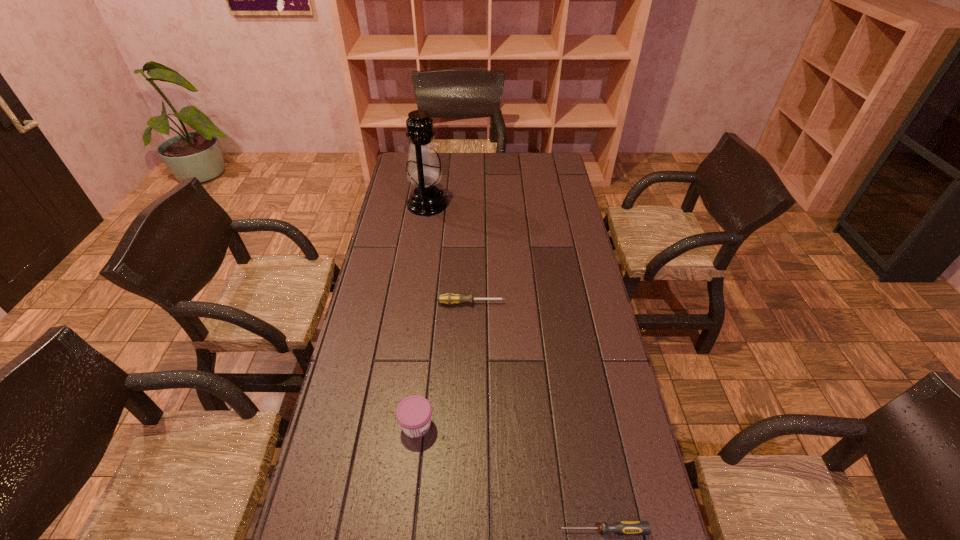
In order to click on oil lamp in this screenshot , I will do click(423, 169).

At what (x,y) coordinates should I click in order to perform the action: click on the farthest object. Please return your answer as a coordinate pair (x, y). The image size is (960, 540). Looking at the image, I should click on (423, 169).

Where is `the third farthest object`? This screenshot has height=540, width=960. the third farthest object is located at coordinates (413, 413).

Locate an element on the screen. jam is located at coordinates (413, 413).

You are a GUI agent. You are given a task and a screenshot of the screen. Output one action in this format:
    pyautogui.click(x=<x>, y=<y>)
    Task: Click on the farther screwdriver
    
    Given the screenshot: What is the action you would take?
    pyautogui.click(x=449, y=298)

At what (x,y) coordinates should I click in order to perform the action: click on the third tallest object. Please return your answer as a coordinate pair (x, y). This screenshot has height=540, width=960. Looking at the image, I should click on (449, 298).

The height and width of the screenshot is (540, 960). In order to click on the shortest object in this screenshot , I will do `click(624, 527)`.

Find the location of a particular element. This screenshot has height=540, width=960. the shorter screwdriver is located at coordinates (624, 527).

Locate an element on the screen. free space located on the back of the tallest object is located at coordinates (432, 172).

Identify the location of free space located on the front label of the second tallest object. The width and height of the screenshot is (960, 540). (564, 425).